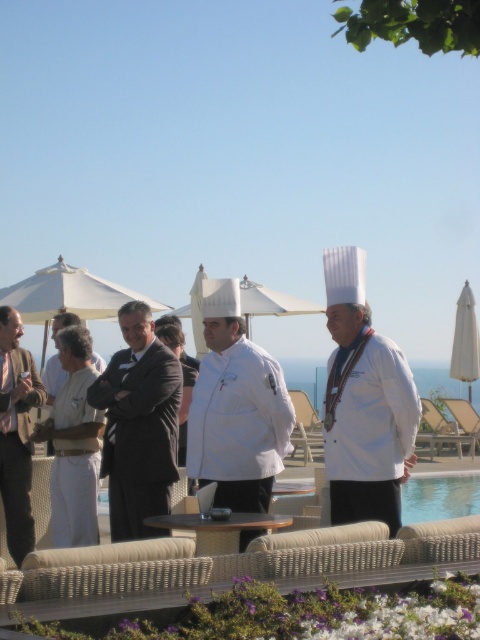
You are a guest at the resort and want to take a photo of the white matte chef coat at center and the white fabric apron at left. Which one should you focus on first to ensure both are in focus?

You should focus on the white matte chef coat at center first because it is closer to the viewer than the white fabric apron at left, so adjusting focus from near to far will help both be in focus.

You are planning to take a photo of the white chef hat at right and the smokey gray suit at center. Which object is narrower in width?

The white chef hat at right is narrower in width than the smokey gray suit at center.